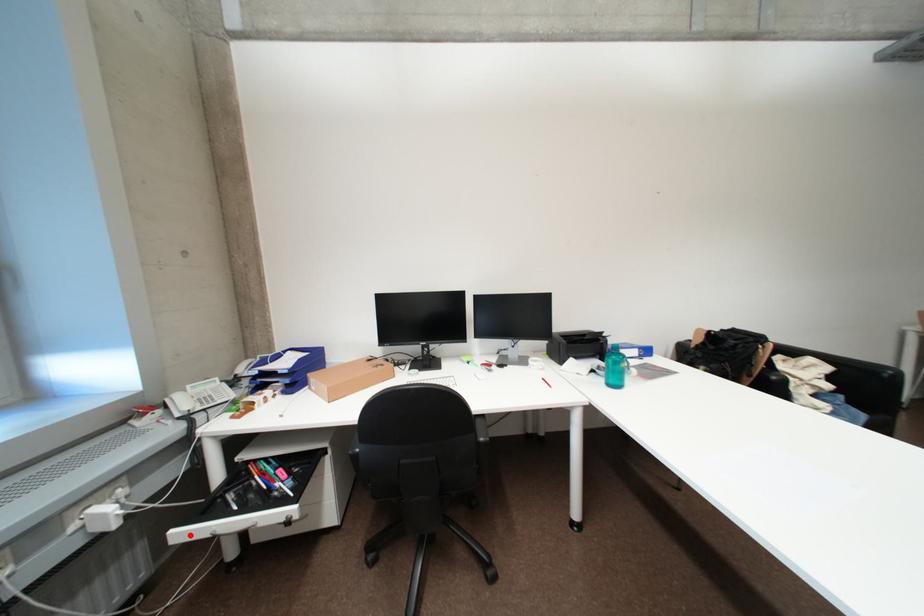
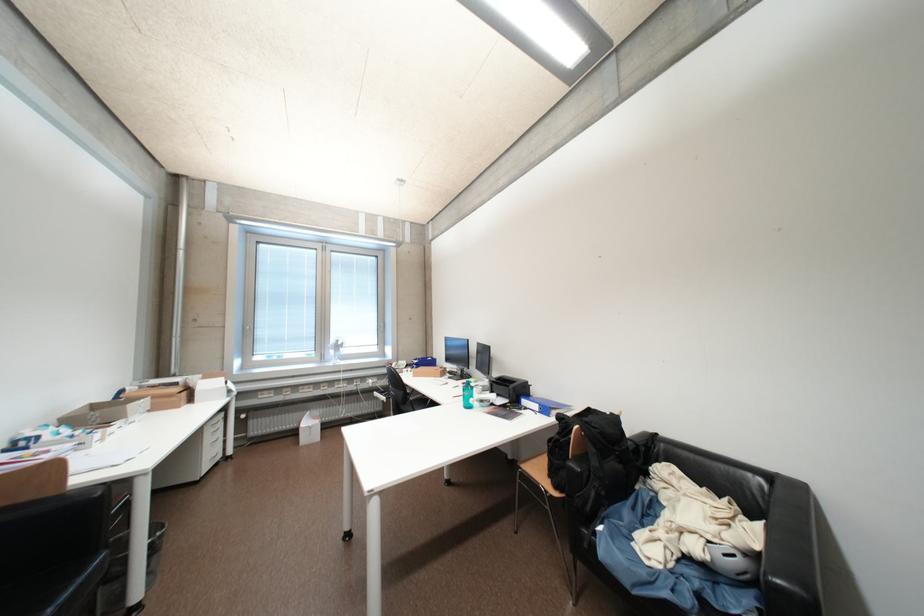
Question: I am providing you with two images of the same scene from different viewpoints. A red point is marked on the first image. Is the red point's position out of view in image 2?

Choices:
 (A) Yes
 (B) No

Answer: (B)